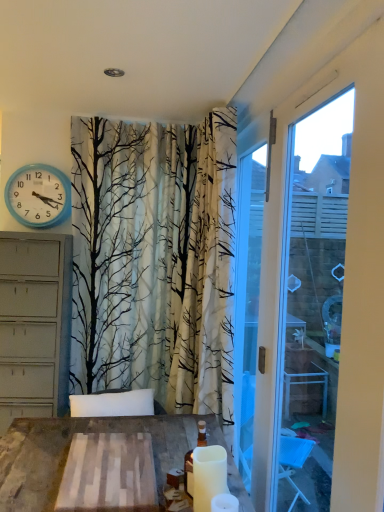
The width and height of the screenshot is (384, 512). What do you see at coordinates (311, 304) in the screenshot? I see `white plastic window frame at right` at bounding box center [311, 304].

What do you see at coordinates (224, 503) in the screenshot? I see `white matte candle at lower right, which ranks as the 2th candle in back-to-front order` at bounding box center [224, 503].

Image resolution: width=384 pixels, height=512 pixels. Identify the location of blue plastic wall clock at upper left. (38, 196).

This screenshot has height=512, width=384. What do you see at coordinates (38, 196) in the screenshot?
I see `blue plastic wall clock at upper left` at bounding box center [38, 196].

Find the location of a particular element. The width and height of the screenshot is (384, 512). white plastic window frame at right is located at coordinates (311, 304).

Which of these two, white plastic window frame at right or white matte candle at lower center, positioned as the second candle in front-to-back order, is smaller?

With smaller size is white matte candle at lower center, positioned as the second candle in front-to-back order.

Choose the correct answer: Is white plastic window frame at right inside white matte candle at lower center, the 1th candle when ordered from back to front, or outside it?

white plastic window frame at right is not inside white matte candle at lower center, the 1th candle when ordered from back to front, it's outside.

Is point (312, 449) more distant than point (223, 473)?

Yes.

Is white plastic window frame at right with white matte candle at lower center, the 1th candle when ordered from back to front?

No, white plastic window frame at right is not with white matte candle at lower center, the 1th candle when ordered from back to front.

Does white matte candle at lower center, the 1th candle when ordered from back to front, appear on the left side of white plastic window frame at right?

Yes.

From a real-world perspective, which object stands above the other?

white plastic window frame at right.

Based on the photo, in terms of height, does white matte candle at lower center, the 1th candle when ordered from back to front, look taller or shorter compared to white plastic window frame at right?

In the image, white matte candle at lower center, the 1th candle when ordered from back to front, appears to be shorter than white plastic window frame at right.

Is white matte candle at lower center, the 1th candle when ordered from back to front, next to white plastic window frame at right and touching it?

white matte candle at lower center, the 1th candle when ordered from back to front, is not next to white plastic window frame at right, and they're not touching.

In the image, there is a white matte candle at lower center, positioned as the second candle in front-to-back order. At what (x,y) coordinates should I click in order to perform the action: click on candle below it (from the image's perspective). Please return your answer as a coordinate pair (x, y). Looking at the image, I should click on (224, 503).

Which is in front, point (216, 499) or point (206, 452)?

The point (206, 452) is closer to the camera.

From the image's perspective, is white matte candle at lower right, which is counted as the 1th candle, starting from the front, below white matte candle at lower center, the 1th candle when ordered from back to front?

Yes, from the image's perspective, white matte candle at lower right, which is counted as the 1th candle, starting from the front, is below white matte candle at lower center, the 1th candle when ordered from back to front.

Between white matte candle at lower right, which is counted as the 1th candle, starting from the front, and white matte candle at lower center, positioned as the second candle in front-to-back order, which one has smaller size?

Smaller between the two is white matte candle at lower right, which is counted as the 1th candle, starting from the front.

Is point (238, 510) closer or farther from the camera than point (57, 214)?

Clearly, point (238, 510) is closer to the camera than point (57, 214).

Considering the sizes of objects white matte candle at lower right, which ranks as the 2th candle in back-to-front order, and blue plastic wall clock at upper left in the image provided, who is smaller, white matte candle at lower right, which ranks as the 2th candle in back-to-front order, or blue plastic wall clock at upper left?

With smaller size is white matte candle at lower right, which ranks as the 2th candle in back-to-front order.

From the image's perspective, is white matte candle at lower right, which ranks as the 2th candle in back-to-front order, under blue plastic wall clock at upper left?

Correct, white matte candle at lower right, which ranks as the 2th candle in back-to-front order, appears lower than blue plastic wall clock at upper left in the image.

Is blue plastic wall clock at upper left in contact with white matte candle at lower right, which ranks as the 2th candle in back-to-front order?

blue plastic wall clock at upper left and white matte candle at lower right, which ranks as the 2th candle in back-to-front order, are not in contact.

Which is less distant, (11, 211) or (215, 504)?

Point (11, 211) is positioned farther from the camera compared to point (215, 504).

Which object is thinner, blue plastic wall clock at upper left or white matte candle at lower right, which ranks as the 2th candle in back-to-front order?

white matte candle at lower right, which ranks as the 2th candle in back-to-front order, is thinner.

Does blue plastic wall clock at upper left appear on the left side of white matte candle at lower right, which ranks as the 2th candle in back-to-front order?

Yes, blue plastic wall clock at upper left is to the left of white matte candle at lower right, which ranks as the 2th candle in back-to-front order.

From the image's perspective, which is below, white plastic window frame at right or white matte candle at lower right, which is counted as the 1th candle, starting from the front?

white matte candle at lower right, which is counted as the 1th candle, starting from the front, from the image's perspective.

Between white plastic window frame at right and white matte candle at lower right, which is counted as the 1th candle, starting from the front, which one appears on the right side from the viewer's perspective?

white plastic window frame at right.

Considering their positions, is white plastic window frame at right located in front of or behind white matte candle at lower right, which ranks as the 2th candle in back-to-front order?

Visually, white plastic window frame at right is located in front of white matte candle at lower right, which ranks as the 2th candle in back-to-front order.

Is white plastic window frame at right oriented away from white matte candle at lower right, which is counted as the 1th candle, starting from the front?

Yes.

Considering the positions of objects blue plastic wall clock at upper left and white matte candle at lower center, positioned as the second candle in front-to-back order, in the image provided, who is more to the right, blue plastic wall clock at upper left or white matte candle at lower center, positioned as the second candle in front-to-back order,?

white matte candle at lower center, positioned as the second candle in front-to-back order.

Is blue plastic wall clock at upper left far from white matte candle at lower center, positioned as the second candle in front-to-back order?

That's right, there is a large distance between blue plastic wall clock at upper left and white matte candle at lower center, positioned as the second candle in front-to-back order.

Is blue plastic wall clock at upper left positioned with its back to white matte candle at lower center, positioned as the second candle in front-to-back order?

No.

Does blue plastic wall clock at upper left lie in front of white matte candle at lower center, the 1th candle when ordered from back to front?

No, blue plastic wall clock at upper left is further to the viewer.

The image size is (384, 512). Identify the location of candle that is the 1st one when counting downward from the white plastic window frame at right (from the image's perspective). (208, 475).

Starting from the white plastic window frame at right, which candle is the 2nd one behind? Please provide its 2D coordinates.

[(208, 475)]

Which object lies further to the anchor point white plastic window frame at right, blue plastic wall clock at upper left or white matte candle at lower center, the 1th candle when ordered from back to front?

blue plastic wall clock at upper left is further to white plastic window frame at right.

Estimate the real-world distances between objects in this image. Which object is closer to blue plastic wall clock at upper left, white matte candle at lower center, the 1th candle when ordered from back to front, or white matte candle at lower right, which is counted as the 1th candle, starting from the front?

Based on the image, white matte candle at lower center, the 1th candle when ordered from back to front, appears to be nearer to blue plastic wall clock at upper left.

Considering their positions, is white matte candle at lower center, the 1th candle when ordered from back to front, positioned further to white plastic window frame at right than blue plastic wall clock at upper left?

blue plastic wall clock at upper left.

When comparing their distances from white matte candle at lower right, which ranks as the 2th candle in back-to-front order, does blue plastic wall clock at upper left or white plastic window frame at right seem further?

blue plastic wall clock at upper left is positioned further to the anchor white matte candle at lower right, which ranks as the 2th candle in back-to-front order.

Which object lies nearer to the anchor point white matte candle at lower center, positioned as the second candle in front-to-back order, white matte candle at lower right, which is counted as the 1th candle, starting from the front, or white plastic window frame at right?

white matte candle at lower right, which is counted as the 1th candle, starting from the front, lies closer to white matte candle at lower center, positioned as the second candle in front-to-back order, than the other object.

Which object lies nearer to the anchor point blue plastic wall clock at upper left, white plastic window frame at right or white matte candle at lower center, the 1th candle when ordered from back to front?

The object closer to blue plastic wall clock at upper left is white plastic window frame at right.

When comparing their distances from white matte candle at lower right, which is counted as the 1th candle, starting from the front, does white matte candle at lower center, the 1th candle when ordered from back to front, or white plastic window frame at right seem closer?

white matte candle at lower center, the 1th candle when ordered from back to front.

Considering their positions, is blue plastic wall clock at upper left positioned further to white matte candle at lower center, the 1th candle when ordered from back to front, than white plastic window frame at right?

The object further to white matte candle at lower center, the 1th candle when ordered from back to front, is blue plastic wall clock at upper left.

Identify the location of candle positioned between white matte candle at lower right, which is counted as the 1th candle, starting from the front, and blue plastic wall clock at upper left from near to far. (208, 475).

Locate an element on the screen. The image size is (384, 512). candle between white plastic window frame at right and white matte candle at lower right, which is counted as the 1th candle, starting from the front, from top to bottom is located at coordinates (208, 475).